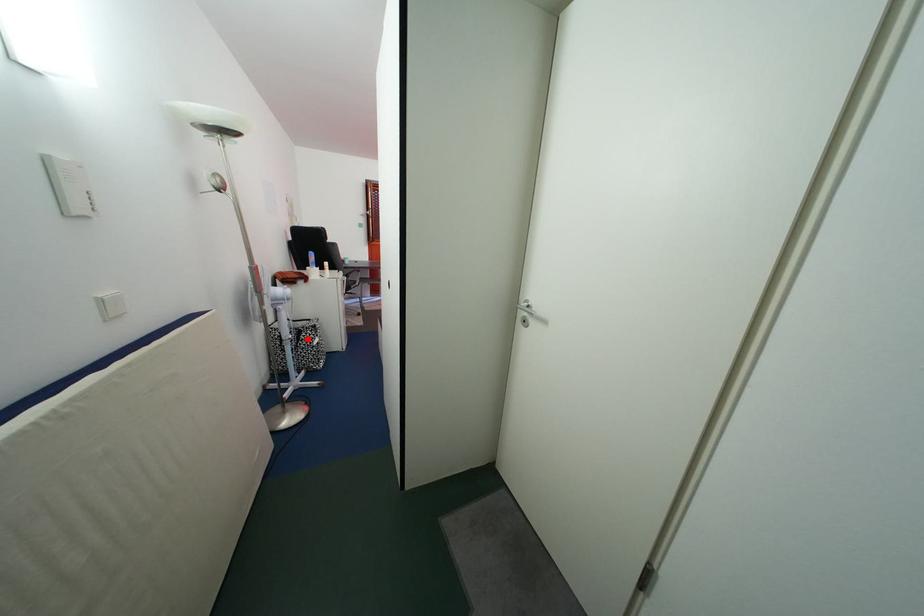
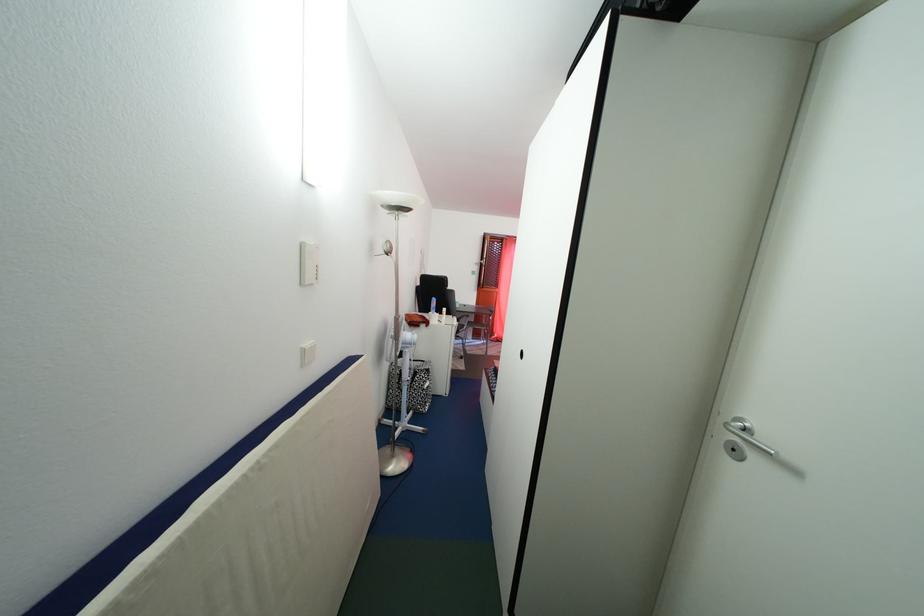
Find the pixel in the second image that matches the highlighted location in the first image.

(423, 381)